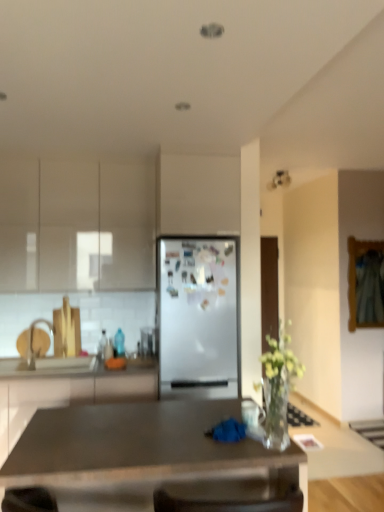
Describe the element at coordinates (76, 225) in the screenshot. I see `matte white cabinets at upper left, placed as the 2th cabinetry when sorted from bottom to top` at that location.

Measure the distance between matte gray desk at center and camera.

5.09 feet.

Locate an element on the screen. white glossy countertop at lower left is located at coordinates click(77, 384).

Find the location of `matte white cabinets at upper left, which is counted as the first cabinetry, starting from the top`. matte white cabinets at upper left, which is counted as the first cabinetry, starting from the top is located at coordinates pos(76,225).

Which is in front, point (152, 373) or point (268, 426)?

The point (268, 426) is closer to the camera.

How much distance is there between white glossy countertop at lower left and clear glass vase at center?

1.78 meters.

In the scene shown: Is white glossy countertop at lower left not within clear glass vase at center?

white glossy countertop at lower left is positioned outside clear glass vase at center.

From a real-world perspective, is white glossy countertop at lower left positioned above or below clear glass vase at center?

From a real-world perspective, white glossy countertop at lower left is physically below clear glass vase at center.

Does matte white cabinets at upper left, placed as the 2th cabinetry when sorted from bottom to top, appear on the right side of clear glass vase at center?

In fact, matte white cabinets at upper left, placed as the 2th cabinetry when sorted from bottom to top, is to the left of clear glass vase at center.

Does matte white cabinets at upper left, placed as the 2th cabinetry when sorted from bottom to top, have a greater height compared to clear glass vase at center?

Indeed, matte white cabinets at upper left, placed as the 2th cabinetry when sorted from bottom to top, has a greater height compared to clear glass vase at center.

Which object is more forward, matte white cabinets at upper left, placed as the 2th cabinetry when sorted from bottom to top, or clear glass vase at center?

clear glass vase at center is closer to the camera.

From the image's perspective, between matte white cabinets at upper left, placed as the 2th cabinetry when sorted from bottom to top, and clear glass vase at center, which one is located above?

matte white cabinets at upper left, placed as the 2th cabinetry when sorted from bottom to top, appears higher in the image.

What's the angular difference between white matte refrigerator at center and clear glass vase at center's facing directions?

1.37 degrees separate the facing orientations of white matte refrigerator at center and clear glass vase at center.

From a real-world perspective, is white matte refrigerator at center positioned above or below clear glass vase at center?

white matte refrigerator at center is situated lower than clear glass vase at center in the real world.

Which is in front, white matte refrigerator at center or clear glass vase at center?

Positioned in front is clear glass vase at center.

Is white matte refrigerator at center positioned beyond the bounds of white glossy cabinet at left, the first cabinetry in the bottom-to-top sequence?

white matte refrigerator at center is positioned outside white glossy cabinet at left, the first cabinetry in the bottom-to-top sequence.

Is point (199, 354) closer to camera compared to point (98, 376)?

Yes, point (199, 354) is in front of point (98, 376).

Is white matte refrigerator at center positioned before white glossy cabinet at left, the first cabinetry in the bottom-to-top sequence?

No, it is behind white glossy cabinet at left, the first cabinetry in the bottom-to-top sequence.

Is white matte refrigerator at center bigger or smaller than white glossy cabinet at left, the first cabinetry in the bottom-to-top sequence?

Clearly, white matte refrigerator at center is smaller in size than white glossy cabinet at left, the first cabinetry in the bottom-to-top sequence.

Is matte white cabinets at upper left, placed as the 2th cabinetry when sorted from bottom to top, far away from matte gray desk at center?

Yes, matte white cabinets at upper left, placed as the 2th cabinetry when sorted from bottom to top, and matte gray desk at center are located far from each other.

In the image, is matte white cabinets at upper left, which is counted as the first cabinetry, starting from the top, positioned in front of or behind matte gray desk at center?

In the image, matte white cabinets at upper left, which is counted as the first cabinetry, starting from the top, appears behind matte gray desk at center.

The image size is (384, 512). I want to click on desk on the right of the matte white cabinets at upper left, placed as the 2th cabinetry when sorted from bottom to top, so click(x=140, y=452).

Who is shorter, matte white cabinets at upper left, which is counted as the first cabinetry, starting from the top, or matte gray desk at center?

matte gray desk at center.

Based on the photo, is matte gray desk at center completely or partially inside white glossy countertop at lower left?

That's incorrect, matte gray desk at center is not inside white glossy countertop at lower left.

From the image's perspective, which is below, white glossy countertop at lower left or matte gray desk at center?

matte gray desk at center.

Can you confirm if white glossy countertop at lower left is smaller than matte gray desk at center?

Yes.

Can you confirm if matte gray desk at center is smaller than matte white cabinets at upper left, placed as the 2th cabinetry when sorted from bottom to top?

Incorrect, matte gray desk at center is not smaller in size than matte white cabinets at upper left, placed as the 2th cabinetry when sorted from bottom to top.

Is the position of matte gray desk at center less distant than that of matte white cabinets at upper left, which is counted as the first cabinetry, starting from the top?

Yes, it is.

Does matte gray desk at center turn towards matte white cabinets at upper left, placed as the 2th cabinetry when sorted from bottom to top?

No, matte gray desk at center is not turned towards matte white cabinets at upper left, placed as the 2th cabinetry when sorted from bottom to top.

How distant is matte gray desk at center from matte white cabinets at upper left, which is counted as the first cabinetry, starting from the top?

matte gray desk at center and matte white cabinets at upper left, which is counted as the first cabinetry, starting from the top, are 5.37 feet apart from each other.

At what (x,y) coordinates should I click in order to perform the action: click on houseplant located on the right of white glossy countertop at lower left. Please return your answer as a coordinate pair (x, y). Image resolution: width=384 pixels, height=512 pixels. Looking at the image, I should click on (278, 386).

Locate an element on the screen. Image resolution: width=384 pixels, height=512 pixels. cabinetry that is the 2nd object to the left of the clear glass vase at center, starting at the anchor is located at coordinates (76, 225).

When comparing their distances from white glossy cabinet at left, the first cabinetry in the bottom-to-top sequence, does white matte refrigerator at center or white glossy countertop at lower left seem closer?

Based on the image, white glossy countertop at lower left appears to be nearer to white glossy cabinet at left, the first cabinetry in the bottom-to-top sequence.

When comparing their distances from white matte refrigerator at center, does white glossy countertop at lower left or white glossy cabinet at left, acting as the second cabinetry starting from the top, seem closer?

white glossy countertop at lower left.

From the image, which object appears to be nearer to clear glass vase at center, white matte refrigerator at center or matte gray desk at center?

matte gray desk at center is positioned closer to the anchor clear glass vase at center.

When comparing their distances from clear glass vase at center, does matte white cabinets at upper left, placed as the 2th cabinetry when sorted from bottom to top, or white glossy countertop at lower left seem closer?

white glossy countertop at lower left is positioned closer to the anchor clear glass vase at center.

Looking at the image, which one is located closer to white glossy cabinet at left, acting as the second cabinetry starting from the top, matte gray desk at center or matte white cabinets at upper left, which is counted as the first cabinetry, starting from the top?

Among the two, matte white cabinets at upper left, which is counted as the first cabinetry, starting from the top, is located nearer to white glossy cabinet at left, acting as the second cabinetry starting from the top.

From the image, which object appears to be nearer to matte gray desk at center, clear glass vase at center or white glossy countertop at lower left?

clear glass vase at center lies closer to matte gray desk at center than the other object.

From the image, which object appears to be farther from white glossy cabinet at left, acting as the second cabinetry starting from the top, matte gray desk at center or white matte refrigerator at center?

matte gray desk at center.

Which object lies nearer to the anchor point white glossy cabinet at left, acting as the second cabinetry starting from the top, matte white cabinets at upper left, which is counted as the first cabinetry, starting from the top, or white matte refrigerator at center?

Based on the image, white matte refrigerator at center appears to be nearer to white glossy cabinet at left, acting as the second cabinetry starting from the top.

This screenshot has height=512, width=384. In order to click on houseplant between matte gray desk at center and matte white cabinets at upper left, which is counted as the first cabinetry, starting from the top, in the front-back direction in this screenshot , I will do `click(278, 386)`.

Locate an element on the screen. Image resolution: width=384 pixels, height=512 pixels. counter top positioned between matte gray desk at center and white matte refrigerator at center from near to far is located at coordinates (77, 384).

The height and width of the screenshot is (512, 384). I want to click on refrigerator between matte white cabinets at upper left, placed as the 2th cabinetry when sorted from bottom to top, and white glossy countertop at lower left in the up-down direction, so click(x=198, y=316).

Find the location of `houseplant between matte gray desk at center and white glossy cabinet at left, the first cabinetry in the bottom-to-top sequence, along the z-axis`. houseplant between matte gray desk at center and white glossy cabinet at left, the first cabinetry in the bottom-to-top sequence, along the z-axis is located at coordinates (278, 386).